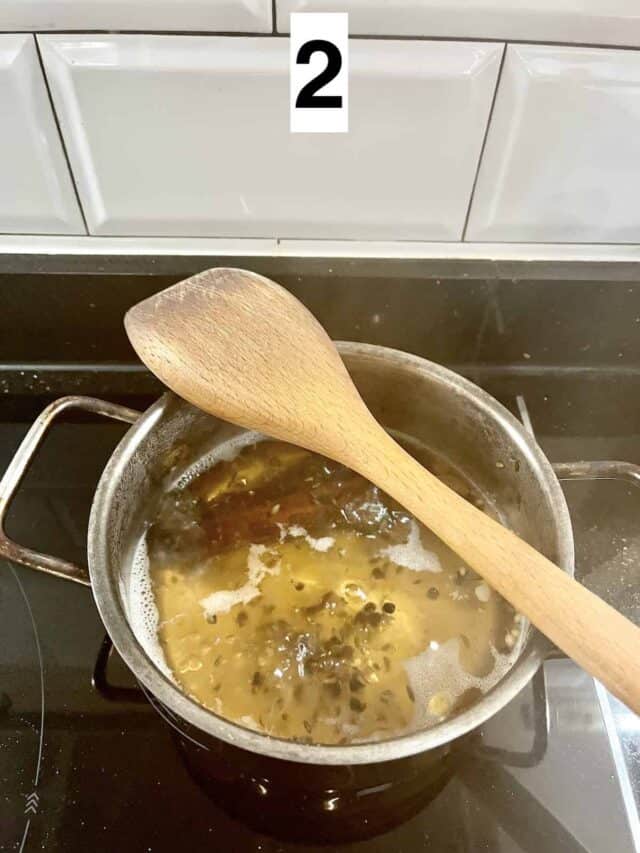
The image size is (640, 853). I want to click on background, white subway title, so click(x=561, y=160).